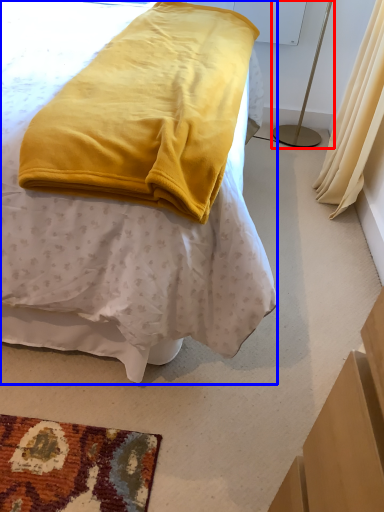
Question: Which of the following is the closest to the observer, bedside lamp (highlighted by a red box) or bed (highlighted by a blue box)?

Choices:
 (A) bedside lamp
 (B) bed

Answer: (B)